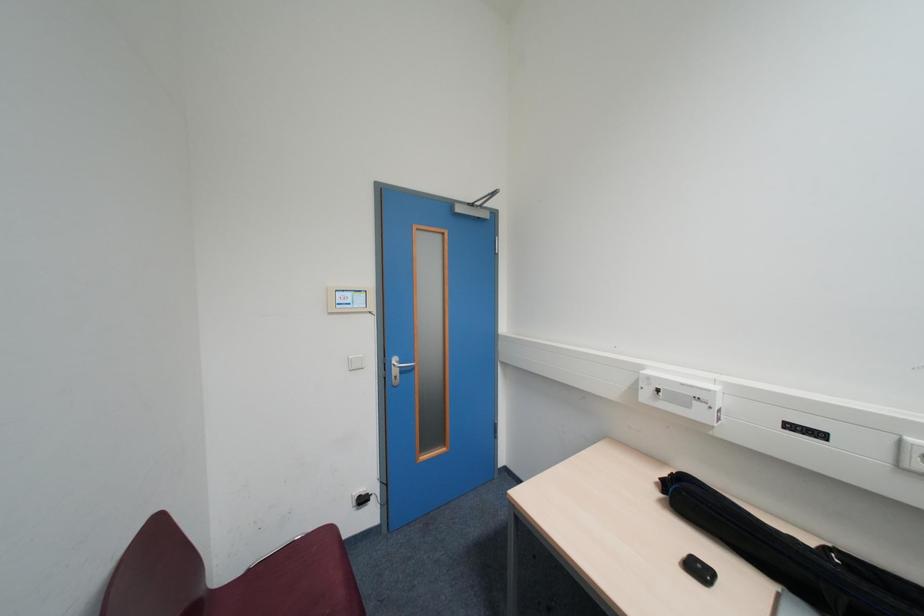
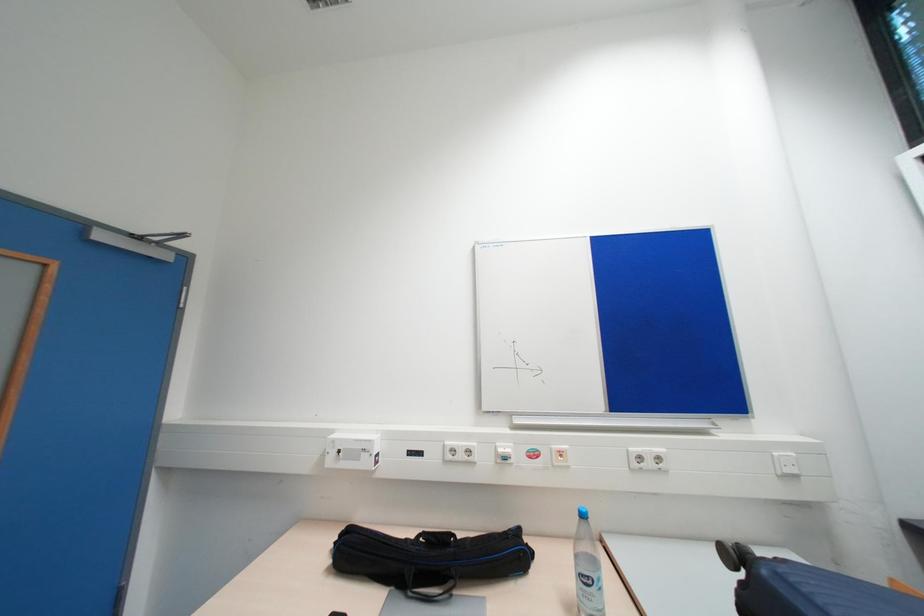
Question: The camera is either moving clockwise (left) or counter-clockwise (right) around the object. The first image is from the beginning of the video and the second image is from the end. Is the camera moving left or right when shooting the video?

Choices:
 (A) Left
 (B) Right

Answer: (A)